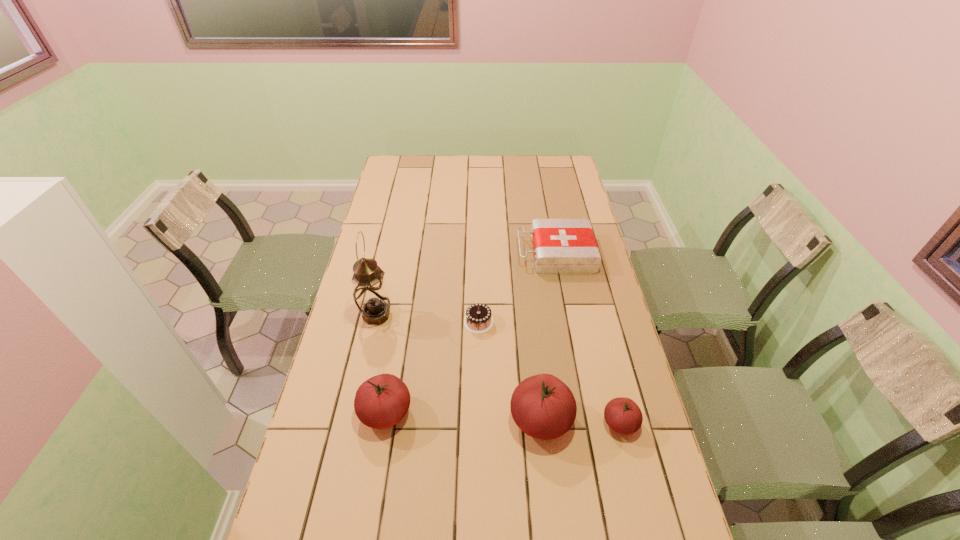
Where is `vacant space in between the shortest tomato and the second tallest tomato`? This screenshot has width=960, height=540. vacant space in between the shortest tomato and the second tallest tomato is located at coordinates (503, 417).

Where is `free space between the rightmost tomato and the leftmost tomato`? The height and width of the screenshot is (540, 960). free space between the rightmost tomato and the leftmost tomato is located at coordinates (503, 417).

Find the location of a particular element. vacant space that's between the fourth object from right to left and the second tomato from right to left is located at coordinates (510, 370).

Locate an element on the screen. free space between the oil lamp and the second tallest tomato is located at coordinates (381, 363).

Locate an element on the screen. Image resolution: width=960 pixels, height=540 pixels. vacant area that lies between the chocolate cake and the farthest object is located at coordinates (517, 288).

Locate which object ranks fifth in proximity to the tallest object. Please provide its 2D coordinates. Your answer should be formatted as a tuple, i.e. [(x, y)], where the tuple contains the x and y coordinates of a point satisfying the conditions above.

[(623, 415)]

Choose which object is the third nearest neighbor to the chocolate cake. Please provide its 2D coordinates. Your answer should be formatted as a tuple, i.e. [(x, y)], where the tuple contains the x and y coordinates of a point satisfying the conditions above.

[(370, 293)]

You are a GUI agent. You are given a task and a screenshot of the screen. Output one action in this format:
    pyautogui.click(x=<x>, y=<y>)
    Task: Click on the tomato that is the closest to the tallest object
    
    Given the screenshot: What is the action you would take?
    pyautogui.click(x=382, y=401)

Image resolution: width=960 pixels, height=540 pixels. I want to click on tomato that is the third closest to the fourth object from right to left, so click(623, 415).

Where is `free space that satisfies the following two spatial constraints: 1. on the front side of the first-aid kit; 2. on the front side of the tallest object`? The height and width of the screenshot is (540, 960). free space that satisfies the following two spatial constraints: 1. on the front side of the first-aid kit; 2. on the front side of the tallest object is located at coordinates (567, 315).